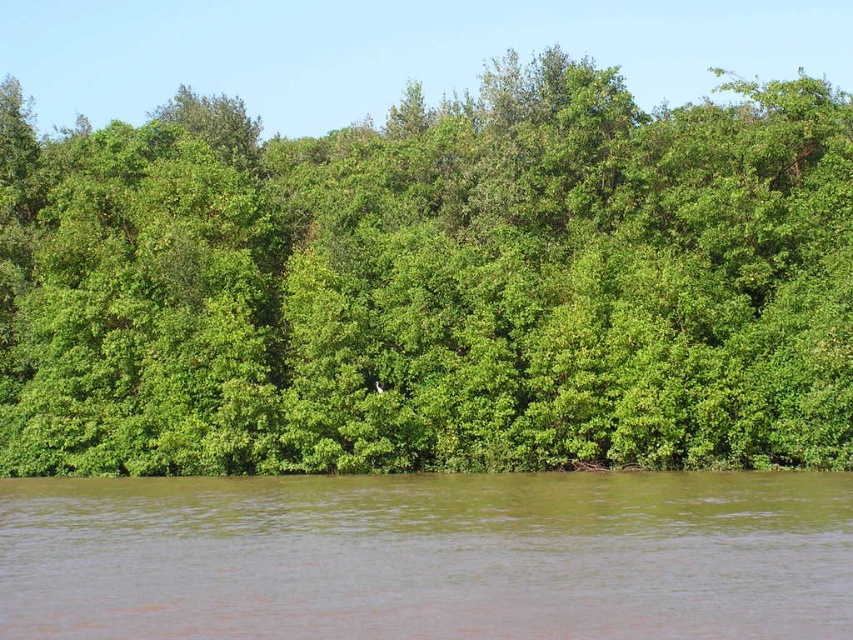
What do you see at coordinates (432, 285) in the screenshot? Image resolution: width=853 pixels, height=640 pixels. I see `green leafy trees at center` at bounding box center [432, 285].

Does point (68, 268) come in front of point (704, 541)?

No, it is behind (704, 541).

Where is `green leafy trees at center`? green leafy trees at center is located at coordinates [432, 285].